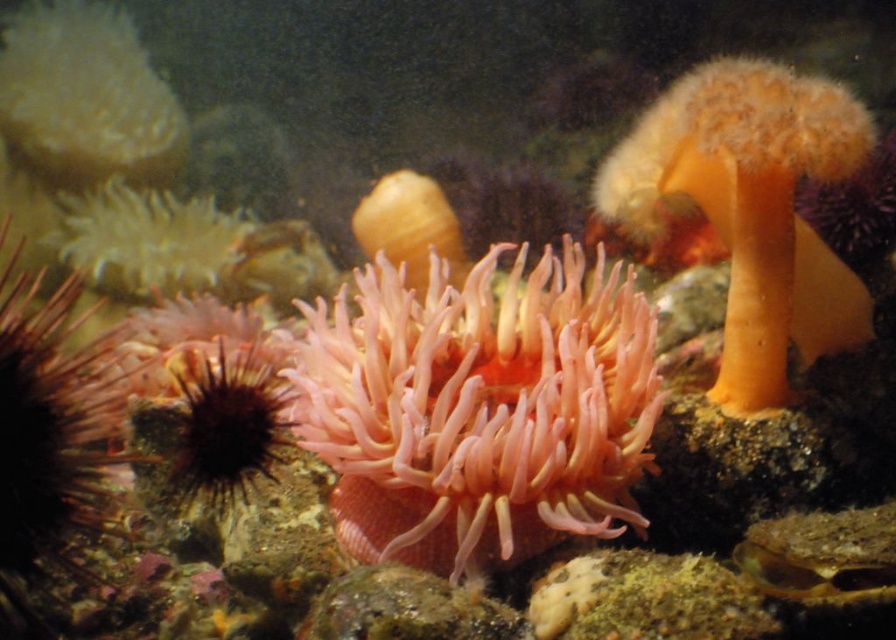
Is fuzzy orange anemone at upper right shorter than translucent pink coral at center?

In fact, fuzzy orange anemone at upper right may be taller than translucent pink coral at center.

Consider the image. Between fuzzy orange anemone at upper right and translucent pink coral at center, which one is positioned higher?

translucent pink coral at center

Does point (824, 109) come closer to viewer compared to point (82, 234)?

Yes.

Identify the location of fuzzy orange anemone at upper right. Image resolution: width=896 pixels, height=640 pixels. (750, 209).

Consider the image. Does fuzzy orange anemone at upper right have a greater width compared to translucent yellowish coral at center?

Indeed, fuzzy orange anemone at upper right has a greater width compared to translucent yellowish coral at center.

Is fuzzy orange anemone at upper right to the right of translucent yellowish coral at center from the viewer's perspective?

Indeed, fuzzy orange anemone at upper right is positioned on the right side of translucent yellowish coral at center.

Between point (781, 209) and point (406, 188), which one is positioned behind?

Positioned behind is point (406, 188).

You are a GUI agent. You are given a task and a screenshot of the screen. Output one action in this format:
    pyautogui.click(x=<x>, y=<y>)
    Task: Click on the fuzzy orange anemone at upper right
    The height and width of the screenshot is (640, 896).
    Given the screenshot: What is the action you would take?
    [750, 209]

Does fuzzy yellow sponge at upper left have a larger size compared to translucent yellowish coral at center?

Indeed, fuzzy yellow sponge at upper left has a larger size compared to translucent yellowish coral at center.

Is point (48, 64) closer to camera compared to point (372, 241)?

That is False.

Find the location of a particular element. fuzzy yellow sponge at upper left is located at coordinates (x=85, y=97).